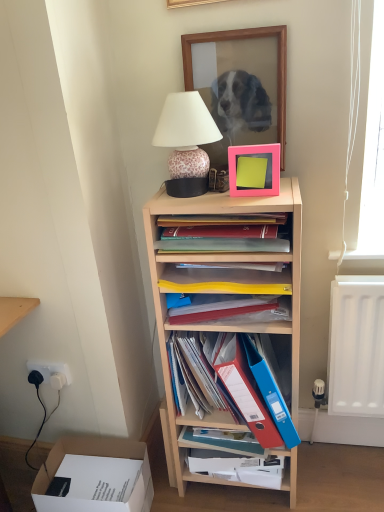
Question: Is white cardboard box at lower left facing away from light wood shelf at center?

Choices:
 (A) no
 (B) yes

Answer: (A)

Question: Is white cardboard box at lower left in front of light wood shelf at center?

Choices:
 (A) yes
 (B) no

Answer: (B)

Question: Is white cardboard box at lower left far from light wood shelf at center?

Choices:
 (A) yes
 (B) no

Answer: (B)

Question: Is white cardboard box at lower left taller than light wood shelf at center?

Choices:
 (A) no
 (B) yes

Answer: (A)

Question: Considering the relative sizes of white cardboard box at lower left and light wood shelf at center in the image provided, is white cardboard box at lower left shorter than light wood shelf at center?

Choices:
 (A) yes
 (B) no

Answer: (A)

Question: Considering the positions of leopard print ceramic lamp at upper center and white cardboard box at lower left in the image, is leopard print ceramic lamp at upper center taller or shorter than white cardboard box at lower left?

Choices:
 (A) tall
 (B) short

Answer: (A)

Question: Considering the relative positions of leopard print ceramic lamp at upper center and white cardboard box at lower left in the image provided, is leopard print ceramic lamp at upper center to the left or to the right of white cardboard box at lower left?

Choices:
 (A) right
 (B) left

Answer: (A)

Question: In terms of width, does leopard print ceramic lamp at upper center look wider or thinner when compared to white cardboard box at lower left?

Choices:
 (A) wide
 (B) thin

Answer: (B)

Question: Relative to white cardboard box at lower left, is leopard print ceramic lamp at upper center in front or behind?

Choices:
 (A) front
 (B) behind

Answer: (A)

Question: From a real-world perspective, is white cardboard box at lower left physically located above or below yellow plastic folder at center, acting as the second book starting from the bottom?

Choices:
 (A) below
 (B) above

Answer: (A)

Question: From the image's perspective, is white cardboard box at lower left above or below yellow plastic folder at center, acting as the second book starting from the bottom?

Choices:
 (A) above
 (B) below

Answer: (B)

Question: In terms of size, does white cardboard box at lower left appear bigger or smaller than yellow plastic folder at center, acting as the second book starting from the bottom?

Choices:
 (A) big
 (B) small

Answer: (A)

Question: From their relative heights in the image, would you say white cardboard box at lower left is taller or shorter than yellow plastic folder at center, acting as the second book starting from the bottom?

Choices:
 (A) tall
 (B) short

Answer: (A)

Question: Considering the relative positions of wooden picture frame at upper center, which appears as the first picture frame when viewed from the back, and yellow plastic folder at center, the 2th book when ordered from top to bottom, in the image provided, is wooden picture frame at upper center, which appears as the first picture frame when viewed from the back, to the left or to the right of yellow plastic folder at center, the 2th book when ordered from top to bottom,?

Choices:
 (A) left
 (B) right

Answer: (B)

Question: From the image's perspective, is wooden picture frame at upper center, which appears as the first picture frame when viewed from the back, above or below yellow plastic folder at center, acting as the second book starting from the bottom?

Choices:
 (A) below
 (B) above

Answer: (B)